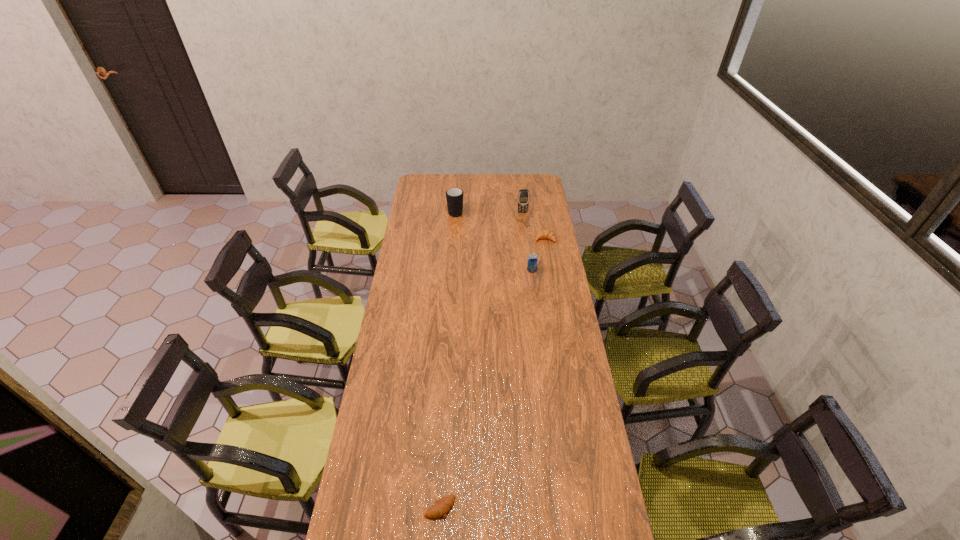
Locate an element on the screen. free space located 0.130m on the side of the mug with the handle is located at coordinates (457, 193).

The image size is (960, 540). In order to click on vacant position located 0.160m on the side of the mug with the handle in this screenshot , I will do `click(457, 191)`.

Where is `vacant space located 0.130m on the left of the fourth farthest object`? This screenshot has height=540, width=960. vacant space located 0.130m on the left of the fourth farthest object is located at coordinates (502, 270).

Find the location of a particular element. vacant area situated 0.390m on the front of the third nearest object is located at coordinates (555, 293).

What are the coordinates of `blank area located on the left of the shortest object` in the screenshot? It's located at (379, 507).

Where is `cellular telephone that is positioned at the right edge`? The width and height of the screenshot is (960, 540). cellular telephone that is positioned at the right edge is located at coordinates (523, 197).

The width and height of the screenshot is (960, 540). I want to click on beer can that is at the right edge, so coord(532,261).

Identify the location of crescent roll that is at the right edge. (545, 234).

At what (x,y) coordinates should I click in order to perform the action: click on blank space at the far edge of the desktop. Please return your answer as a coordinate pair (x, y). This screenshot has width=960, height=540. Looking at the image, I should click on (470, 191).

The image size is (960, 540). In order to click on vacant space at the left edge of the desktop in this screenshot , I will do `click(418, 219)`.